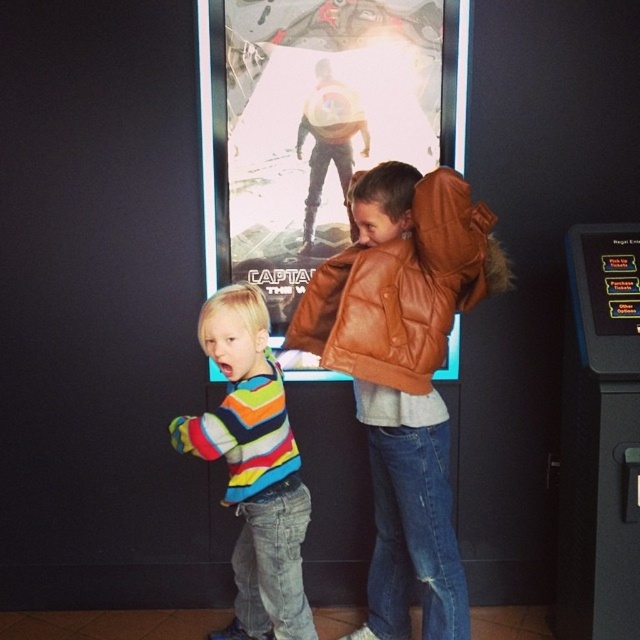
You are a security camera in the movie theater entrance. You need to determine if the brown leather jacket at center is located within the restricted area which is a rectangle from point 0.4 to 0.6 on the x and y axis. Is it inside?

The brown leather jacket at center is located at point (403, 291). Since the restricted area spans from 0.4 to 0.6 on both axes, the x coordinate 0.455 is within the range, but the y coordinate 0.630 exceeds 0.6. Therefore, the jacket is partially outside the restricted area.

You are a photographer trying to capture a candid shot of the two children. The camera is positioned at point A, which is at coordinates 0.0, 0.0. The brown leather jacket at center is represented by point B at coordinates (403, 291). If you want to ensure the child wearing the brown leather jacket at center is in focus, which direction should you adjust the camera to point towards?

The camera should be adjusted to point towards point B at coordinates (403, 291) to ensure the child wearing the brown leather jacket at center is in focus.

You are a parent trying to decide which item to grab first between the black plastic slot machine at right and the striped cotton shirt at center. Based on their sizes, which one do you think is taller?

The black plastic slot machine at right is taller than the striped cotton shirt at center, so you should grab the black plastic slot machine at right first if you need to handle the taller item first.